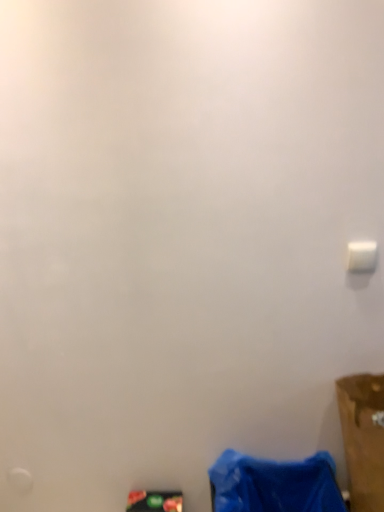
Question: Is matte black phone at lower center, placed as the 1th waste when sorted from left to right, wider or thinner than white plastic light switch at upper right?

Choices:
 (A) thin
 (B) wide

Answer: (B)

Question: Choose the correct answer: Is matte black phone at lower center, which ranks as the 2th waste in right-to-left order, inside white plastic light switch at upper right or outside it?

Choices:
 (A) outside
 (B) inside

Answer: (A)

Question: Which of these objects is positioned closest to the matte black phone at lower center, which ranks as the 2th waste in right-to-left order?

Choices:
 (A) white plastic light switch at upper right
 (B) blue fabric bag at lower right, acting as the second waste starting from the left
 (C) brown cardboard box at lower right

Answer: (B)

Question: Which is farther from the matte black phone at lower center, placed as the 1th waste when sorted from left to right?

Choices:
 (A) brown cardboard box at lower right
 (B) blue fabric bag at lower right, the first waste when ordered from right to left
 (C) white plastic light switch at upper right

Answer: (C)